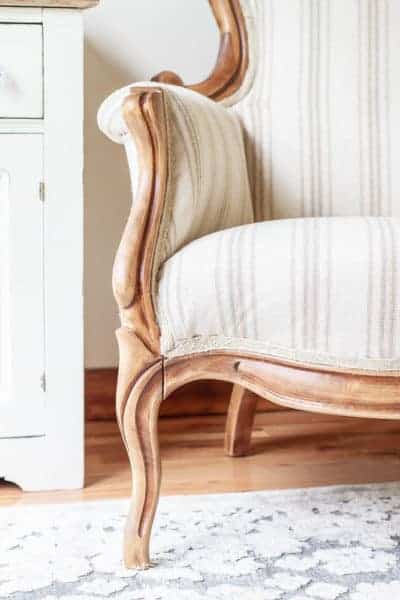
Locate an element on the screen. The height and width of the screenshot is (600, 400). stripes on upholstered chair is located at coordinates tap(238, 265), tap(310, 266), tap(379, 266), tap(171, 282).